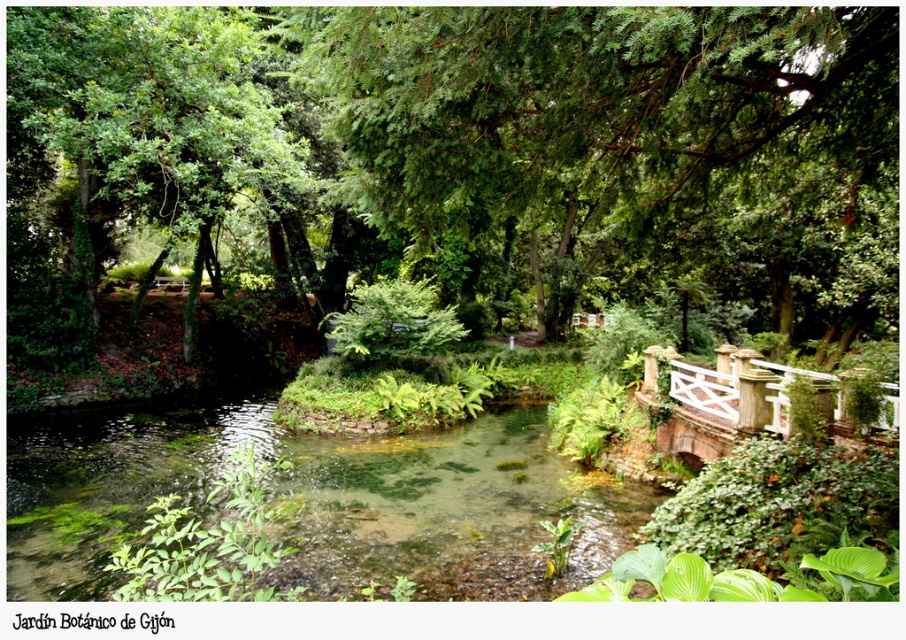
Question: Does green leafy tree at center appear under white wooden bridge at right?

Choices:
 (A) no
 (B) yes

Answer: (A)

Question: From the image, what is the correct spatial relationship of green leafy tree at upper left in relation to white wooden bridge at right?

Choices:
 (A) right
 (B) left

Answer: (B)

Question: Which point appears farthest from the camera in this image?

Choices:
 (A) (191, 141)
 (B) (719, 432)

Answer: (A)

Question: Estimate the real-world distances between objects in this image. Which object is closer to the green leafy tree at upper left?

Choices:
 (A) white wooden bridge at right
 (B) green leafy tree at center

Answer: (B)

Question: Which point is closer to the camera?

Choices:
 (A) green leafy tree at center
 (B) white wooden bridge at right

Answer: (A)

Question: Is green leafy tree at center bigger than white wooden bridge at right?

Choices:
 (A) yes
 (B) no

Answer: (A)